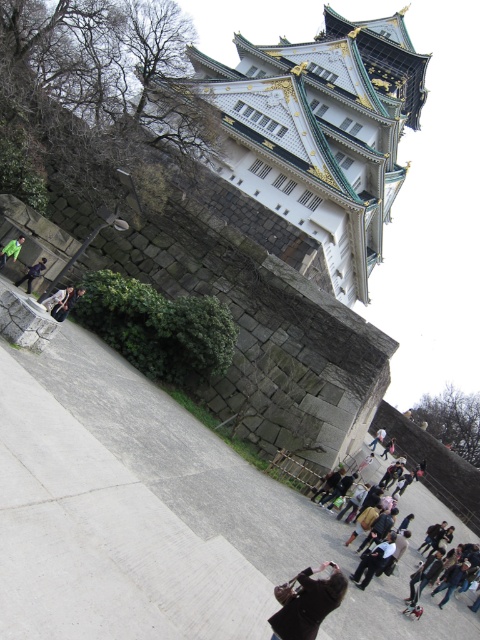
In order to click on dark gray fabric jacket at lower center in this screenshot , I will do `click(373, 560)`.

Is point (369, 556) positioned in front of point (52, 296)?

Yes.

This screenshot has height=640, width=480. I want to click on dark gray fabric jacket at lower center, so click(373, 560).

Where is `dark gray fabric jacket at lower center`? dark gray fabric jacket at lower center is located at coordinates (373, 560).

Who is lower down, dark brown leather coat at center or matte black jacket at lower center?

dark brown leather coat at center is below.

Does point (338, 592) lie behind point (52, 310)?

No.

Who is more forward, (333,596) or (47,305)?

Point (333,596)

Where is `dark brown leather coat at center`? The width and height of the screenshot is (480, 640). dark brown leather coat at center is located at coordinates (309, 604).

Which is below, white stone tower at upper center or dark blue jeans at lower left?

Positioned lower is dark blue jeans at lower left.

Between point (331, 80) and point (26, 282), which one is positioned behind?

Positioned behind is point (331, 80).

Locate an element on the screen. This screenshot has height=640, width=480. white stone tower at upper center is located at coordinates (321, 134).

Where is `white stone tower at upper center`? The width and height of the screenshot is (480, 640). white stone tower at upper center is located at coordinates (321, 134).